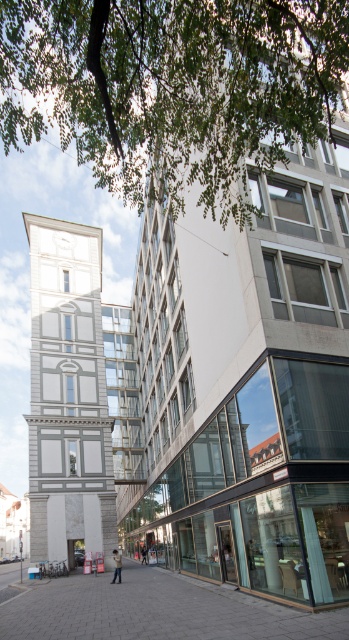
Question: Which of the following is the farthest from the observer?

Choices:
 (A) (3, 632)
 (B) (117, 552)

Answer: (B)

Question: Which point is farther from the camera taking this photo?

Choices:
 (A) (120, 566)
 (B) (175, 580)
 (C) (144, 556)

Answer: (C)

Question: Is light brown leather jacket at center closer to the viewer compared to dark blue jeans at center?

Choices:
 (A) yes
 (B) no

Answer: (A)

Question: Estimate the real-world distances between objects in this image. Which object is closer to the dark blue jeans at center?

Choices:
 (A) light brown leather jacket at center
 (B) paved stone sidewalk at center

Answer: (A)

Question: Can you confirm if paved stone sidewalk at center is positioned to the left of dark blue jeans at center?

Choices:
 (A) yes
 (B) no

Answer: (A)

Question: Is light brown leather jacket at center to the right of dark blue jeans at center from the viewer's perspective?

Choices:
 (A) yes
 (B) no

Answer: (B)